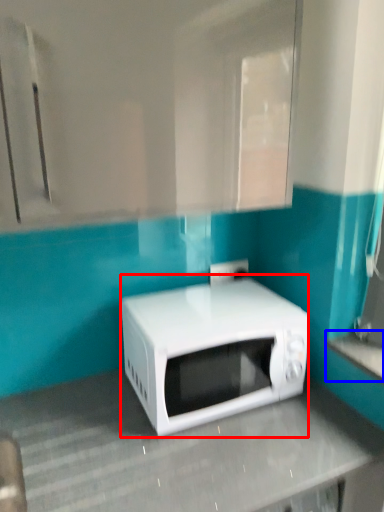
Question: Which object is further to the camera taking this photo, microwave oven (highlighted by a red box) or counter top (highlighted by a blue box)?

Choices:
 (A) microwave oven
 (B) counter top

Answer: (A)